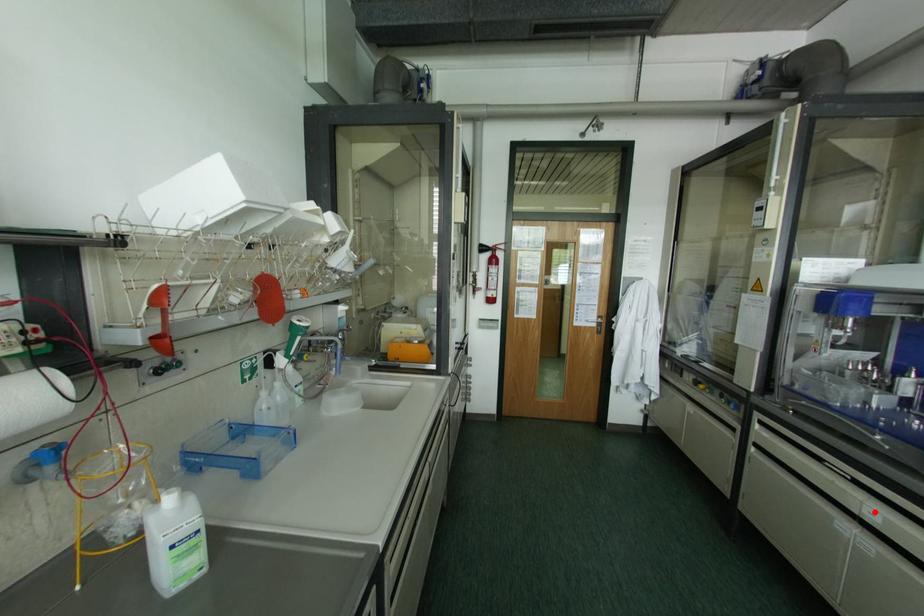
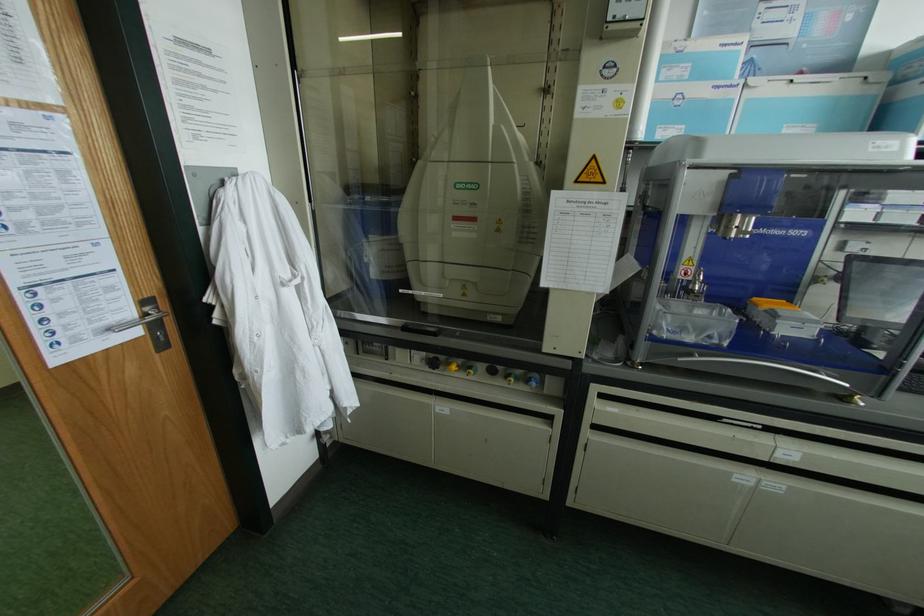
Question: I am providing you with two images of the same scene from different viewpoints. A red point is shown in image1. For the corresponding object point in image2, is it positioned nearer or farther from the camera?

Choices:
 (A) Nearer
 (B) Farther

Answer: (A)